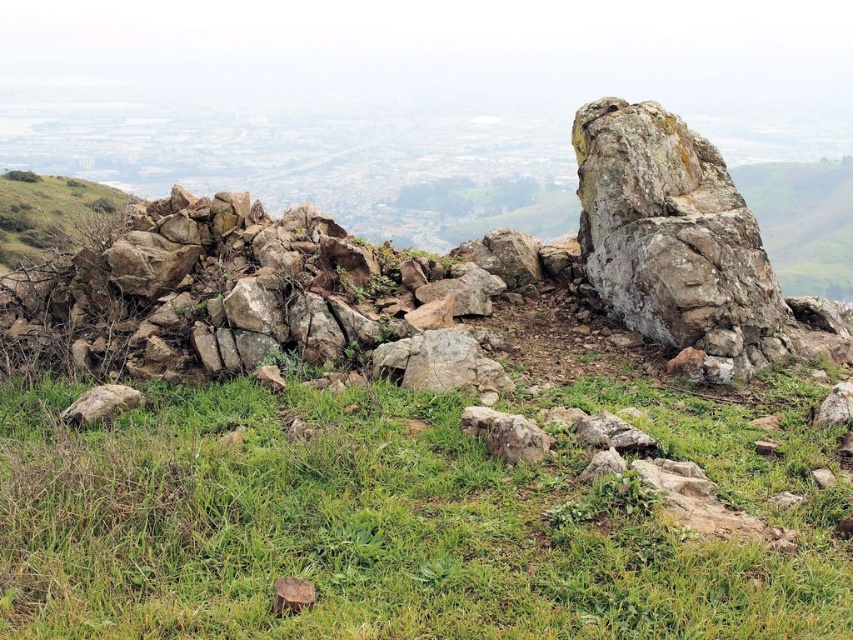
Question: Can you confirm if rough textured rock at center is smaller than smooth gray rock at lower left?

Choices:
 (A) no
 (B) yes

Answer: (A)

Question: Considering the relative positions of green grassy at lower center and smooth gray rock at lower left in the image provided, where is green grassy at lower center located with respect to smooth gray rock at lower left?

Choices:
 (A) below
 (B) above

Answer: (A)

Question: Which of the following is the farthest from the observer?

Choices:
 (A) rusty metallic rock at center
 (B) gray rough rock at center
 (C) green grassy at lower center
 (D) smooth gray rock at lower left

Answer: (A)

Question: Which of the following is the closest to the observer?

Choices:
 (A) pos(62,420)
 (B) pos(374,358)
 (C) pos(57,566)
 (D) pos(503,428)

Answer: (C)

Question: Considering the real-world distances, which object is closest to the rough textured rock at center?

Choices:
 (A) smooth gray rock at lower left
 (B) gray rough rock at center
 (C) green grassy at lower center
 (D) rusty metallic rock at center

Answer: (D)

Question: Can you confirm if rough textured rock at center is wider than rusty metallic rock at center?

Choices:
 (A) yes
 (B) no

Answer: (A)